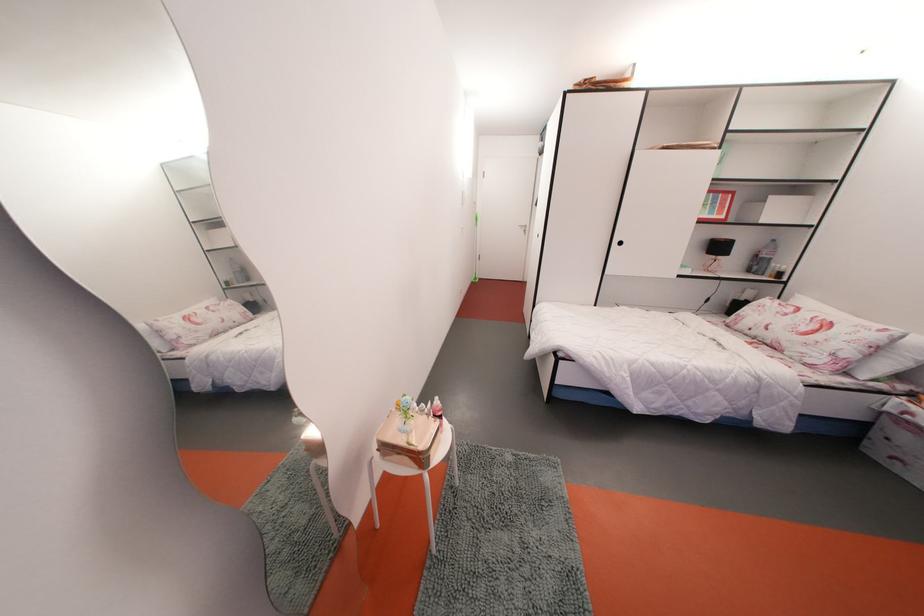
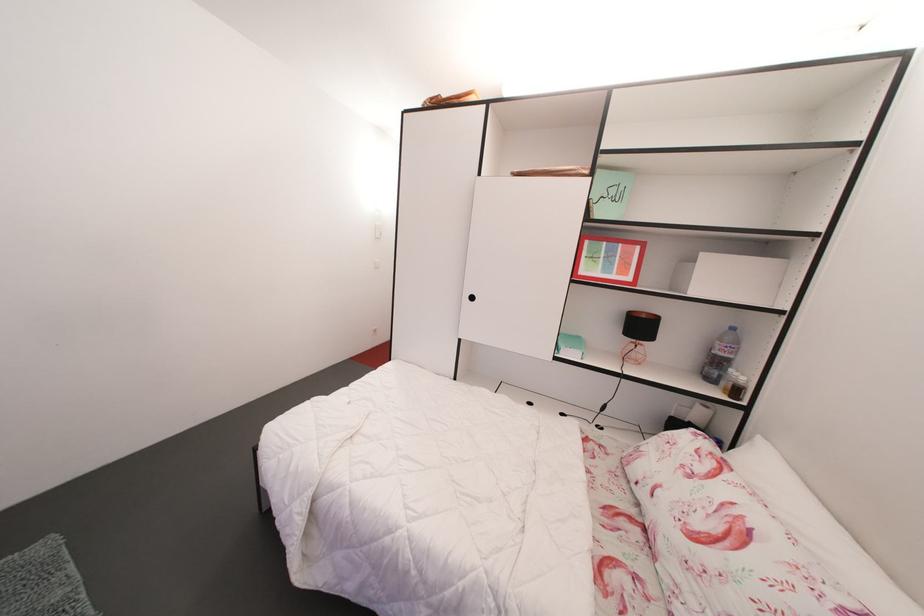
In the scene shown: The images are taken continuously from a first-person perspective. In which direction are you moving?

The cameraman moved toward right, forward.